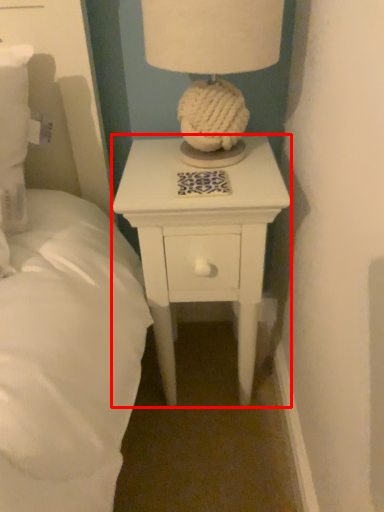
Question: From the image's perspective, what is the correct spatial positioning of nightstand (annotated by the red box) in reference to table lamp?

Choices:
 (A) above
 (B) below

Answer: (B)